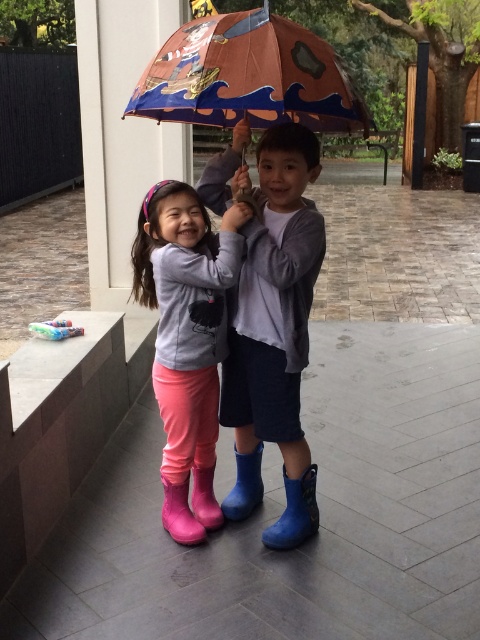
You are a delivery robot trying to navigate between the cartoon paper umbrella at center and the pink rubber boot at lower center. Since the umbrella is much taller than the boot, will you need to worry about hitting your head while moving between them?

The cartoon paper umbrella at center is much taller than the pink rubber boot at lower center, so the height difference between them means the robot should be cautious of the umbrella when moving between them to avoid hitting its head.

Consider the image. You are a parent trying to choose between two pairs of rain boots for your child. You see the pink rubber boots at center and the rubber boots at lower center in the image. Which pair is taller?

The pink rubber boots at center are taller than the rubber boots at lower center.

You are a delivery robot trying to deliver a package to the children under the umbrella. The path between the pink rubber boots at center and the rubber boots at lower center is narrow. Can you pass through this path if your width is 40 cm?

The pink rubber boots at center might be wider than rubber boots at lower center, but since the exact width difference isn not specified, it is uncertain if the 40 cm wide robot can pass through the narrow path between them.